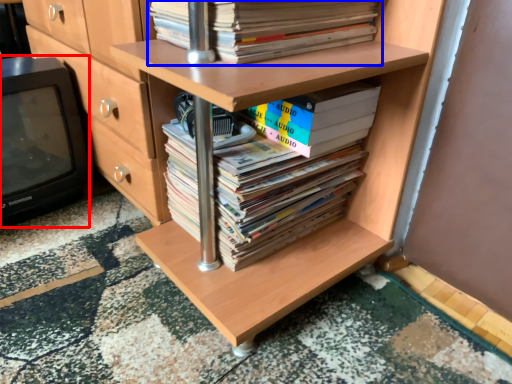
Question: Which object is closer to the camera taking this photo, wide (highlighted by a red box) or book (highlighted by a blue box)?

Choices:
 (A) wide
 (B) book

Answer: (B)